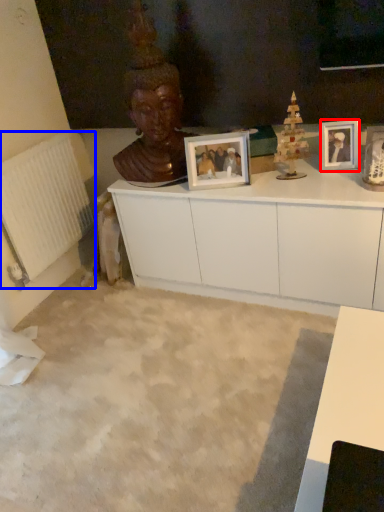
Question: Which of the following is the farthest to the observer, picture frame (highlighted by a red box) or radiator (highlighted by a blue box)?

Choices:
 (A) picture frame
 (B) radiator

Answer: (B)